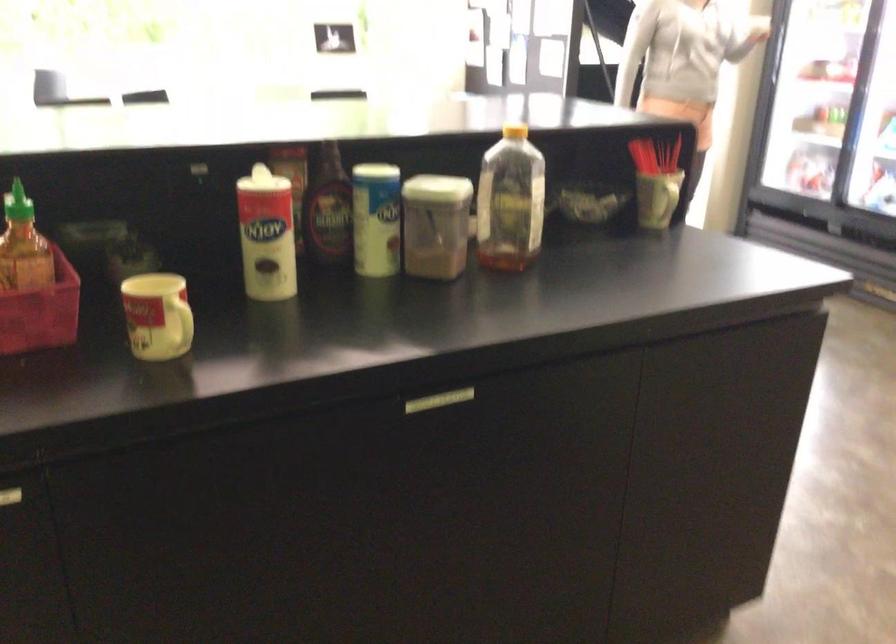
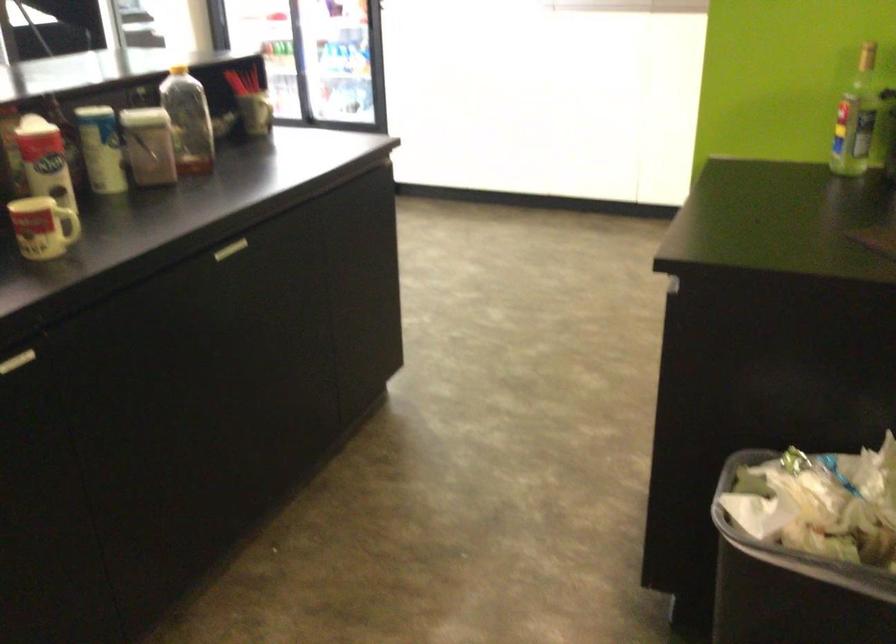
Find the pixel in the second image that matches (x=132, y=316) in the first image.

(42, 228)